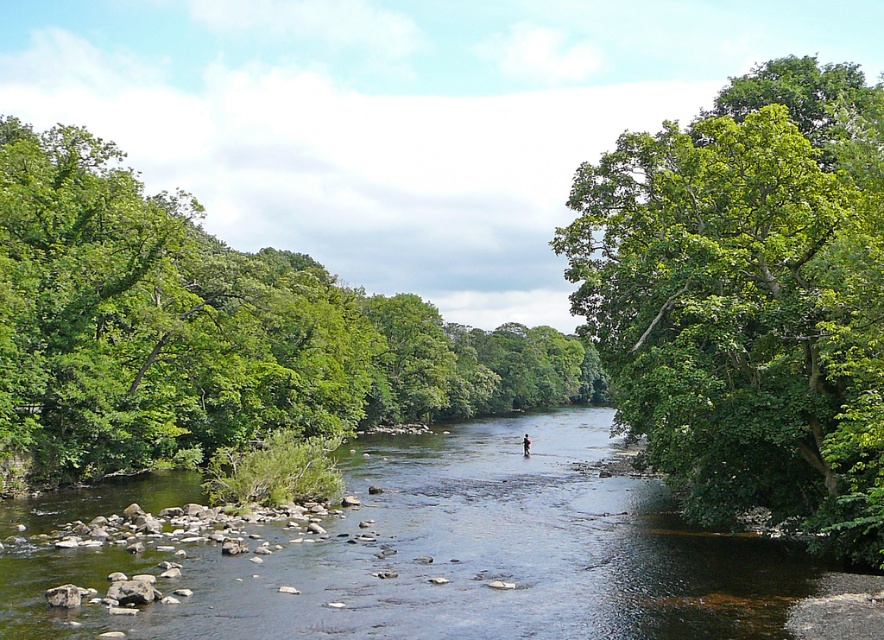
Does green leafy tree at upper right have a lesser width compared to clear water at center?

Yes, green leafy tree at upper right is thinner than clear water at center.

Between point (696, 358) and point (116, 512), which one is positioned in front?

Positioned in front is point (696, 358).

You are a GUI agent. You are given a task and a screenshot of the screen. Output one action in this format:
    pyautogui.click(x=<x>, y=<y>)
    Task: Click on the green leafy tree at upper right
    
    Given the screenshot: What is the action you would take?
    pyautogui.click(x=748, y=296)

Looking at this image, is green leafy tree at center above clear water at center?

Indeed, green leafy tree at center is positioned over clear water at center.

Can you confirm if green leafy tree at center is shorter than clear water at center?

Incorrect, green leafy tree at center's height does not fall short of clear water at center's.

Does point (349, 346) come closer to viewer compared to point (620, 636)?

No, it is behind (620, 636).

Identify the location of green leafy tree at center. (212, 330).

At what (x,y) coordinates should I click in order to perform the action: click on clear water at center. Please return your answer as a coordinate pair (x, y). Looking at the image, I should click on (450, 554).

This screenshot has height=640, width=884. What do you see at coordinates (450, 554) in the screenshot?
I see `clear water at center` at bounding box center [450, 554].

Find the location of `clear water at center`. clear water at center is located at coordinates click(450, 554).

Where is `clear water at center`? The image size is (884, 640). clear water at center is located at coordinates (450, 554).